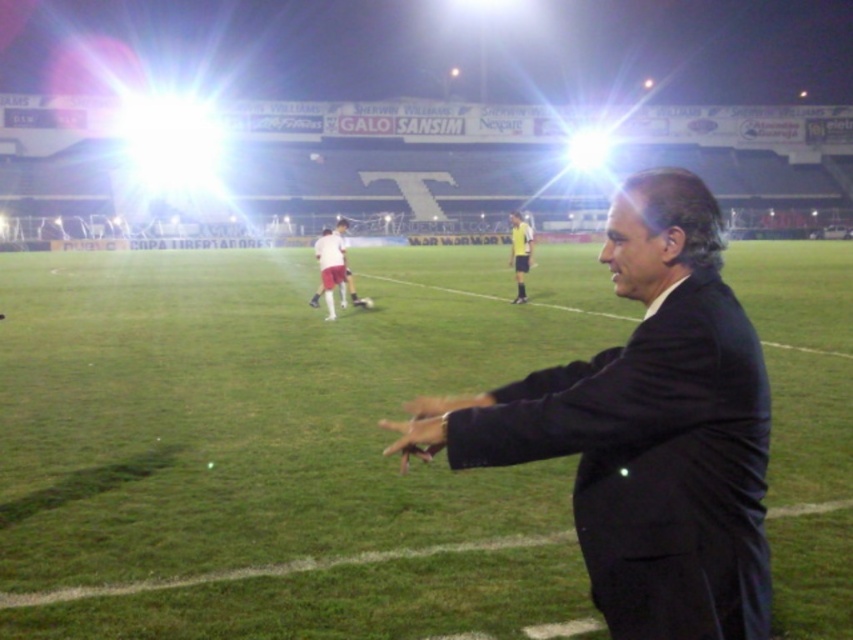
Can you confirm if green grass at center is bigger than black suit at right?

Correct, green grass at center is larger in size than black suit at right.

Does green grass at center lie in front of black suit at right?

No.

The width and height of the screenshot is (853, 640). What do you see at coordinates (277, 442) in the screenshot?
I see `green grass at center` at bounding box center [277, 442].

In order to click on green grass at center in this screenshot , I will do `click(277, 442)`.